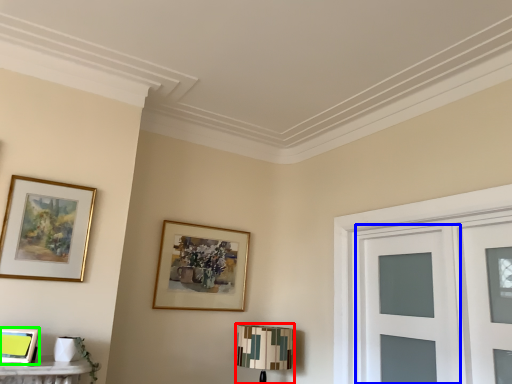
Question: Which is nearer to the table lamp (highlighted by a red box)? glass door (highlighted by a blue box) or picture frame (highlighted by a green box).

Choices:
 (A) glass door
 (B) picture frame

Answer: (A)